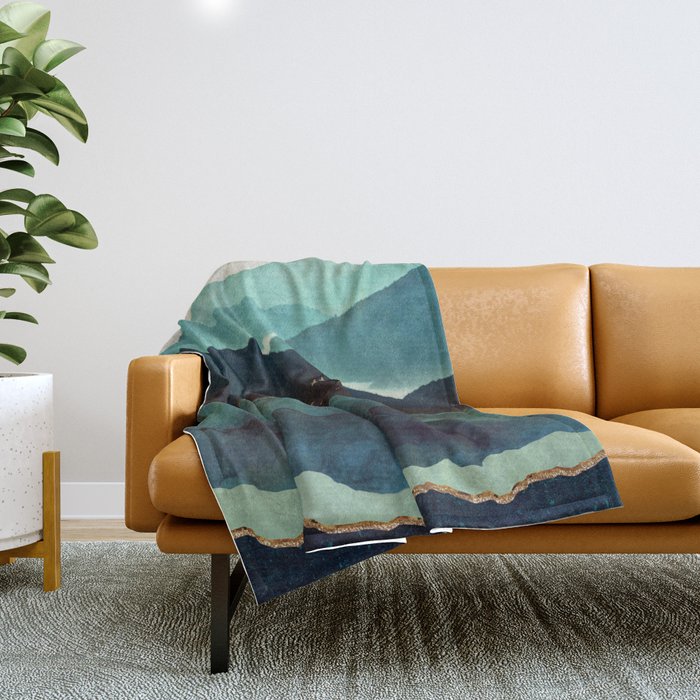
Image resolution: width=700 pixels, height=700 pixels. Identify the location of molding. (104, 496).